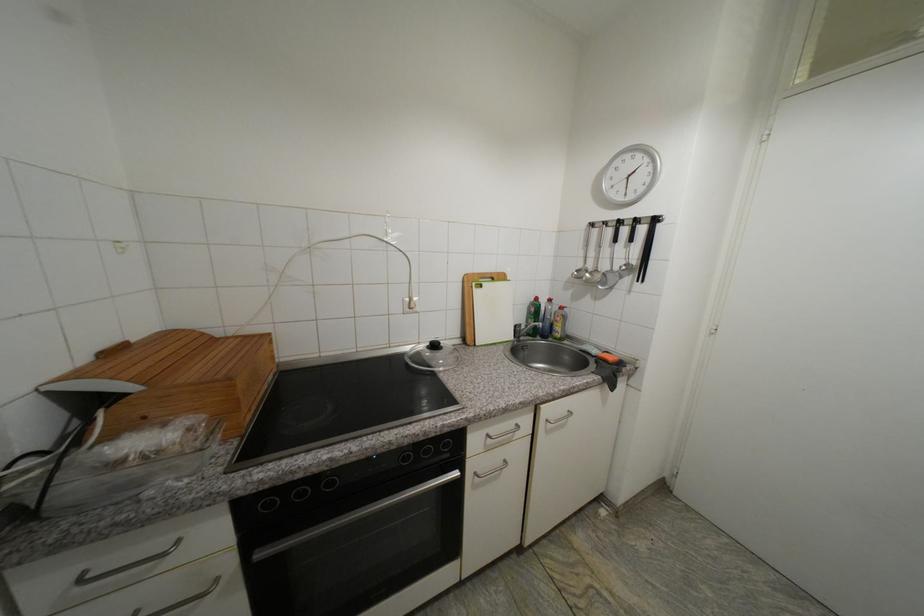
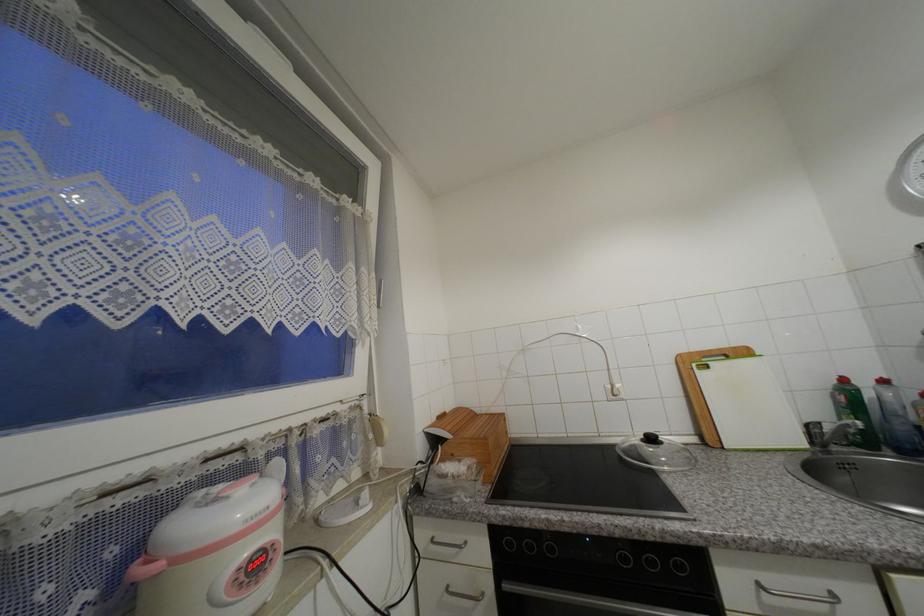
The point at (x=91, y=360) is marked in the first image. Where is the corresponding point in the second image?

(440, 419)